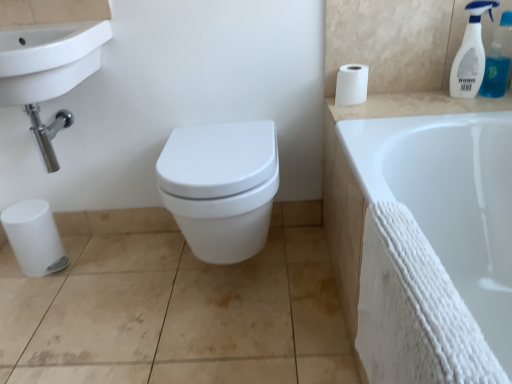
Question: Is point (393, 112) closer or farther from the camera than point (339, 99)?

Choices:
 (A) closer
 (B) farther

Answer: (A)

Question: From their relative heights in the image, would you say white ceramic counter top at upper right is taller or shorter than white matte toilet paper at upper right?

Choices:
 (A) tall
 (B) short

Answer: (B)

Question: Which of these objects is positioned farthest from the white glossy bidet at center?

Choices:
 (A) clear plastic spray bottle at upper right, the second cleaning product in the left-to-right sequence
 (B) white ceramic sink at upper left
 (C) white plastic spray bottle at upper right, the first cleaning product from the left
 (D) white textured towel at lower right
 (E) white matte toilet paper at upper right

Answer: (A)

Question: Estimate the real-world distances between objects in this image. Which object is farther from the white textured towel at lower right?

Choices:
 (A) white ceramic sink at upper left
 (B) white matte toilet paper at upper right
 (C) clear plastic spray bottle at upper right, the second cleaning product in the left-to-right sequence
 (D) white glossy bidet at center
 (E) white plastic spray bottle at upper right, which ranks as the second cleaning product in right-to-left order

Answer: (A)